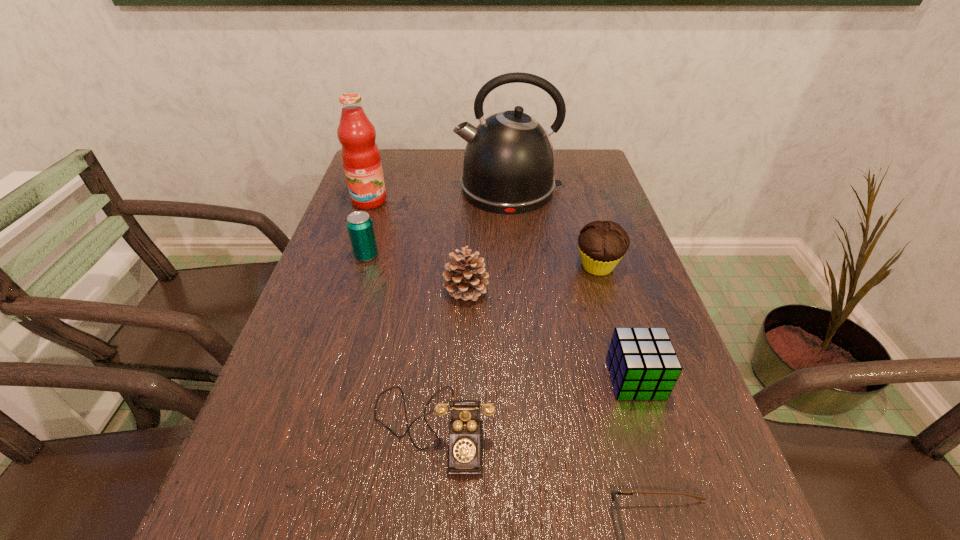
Locate an element on the screen. Image resolution: width=960 pixels, height=540 pixels. vacant region located 0.200m on the front label of the fruit juice is located at coordinates (350, 256).

This screenshot has height=540, width=960. In order to click on vacant area situated 0.090m on the right of the beer can in this screenshot , I will do `click(416, 256)`.

This screenshot has width=960, height=540. I want to click on free point located 0.350m on the left of the muffin, so click(426, 266).

The height and width of the screenshot is (540, 960). In order to click on vacant space located 0.130m on the right of the pinecone in this screenshot , I will do `click(546, 291)`.

Locate an element on the screen. The image size is (960, 540). free space located 0.070m on the dial of the telephone is located at coordinates (424, 526).

At what (x,y) coordinates should I click in order to perform the action: click on vacant space located 0.170m on the left of the cube. Please return your answer as a coordinate pair (x, y). Image resolution: width=960 pixels, height=540 pixels. Looking at the image, I should click on (518, 379).

The width and height of the screenshot is (960, 540). I want to click on object present at the far edge, so click(x=509, y=162).

In order to click on fruit juice located at the left edge in this screenshot , I will do [x=360, y=154].

I want to click on beer can that is at the left edge, so click(360, 228).

Where is `kettle present at the right edge`? The width and height of the screenshot is (960, 540). kettle present at the right edge is located at coordinates (509, 162).